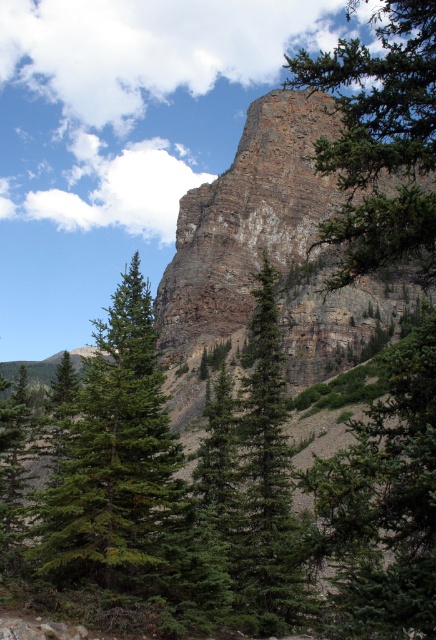
Can you confirm if green needle-like tree at center is positioned above rusty brown rock at upper center?

Incorrect, green needle-like tree at center is not positioned above rusty brown rock at upper center.

The height and width of the screenshot is (640, 436). What do you see at coordinates (115, 456) in the screenshot?
I see `green needle-like tree at center` at bounding box center [115, 456].

This screenshot has height=640, width=436. What are the coordinates of `green needle-like tree at center` in the screenshot? It's located at pyautogui.click(x=115, y=456).

Which is behind, point (160, 504) or point (245, 536)?

Point (245, 536)

The height and width of the screenshot is (640, 436). What do you see at coordinates (115, 456) in the screenshot? I see `green needle-like tree at center` at bounding box center [115, 456].

Does point (91, 516) come closer to viewer compared to point (255, 419)?

Yes, point (91, 516) is closer to viewer.

Locate an element on the screen. The width and height of the screenshot is (436, 640). green needle-like tree at center is located at coordinates (115, 456).

Who is more distant from viewer, [133,572] or [401,45]?

The point [401,45] is behind.

Who is higher up, green needle-like tree at center or green textured pine tree at upper right?

green textured pine tree at upper right is higher up.

Is point (115, 307) less distant than point (429, 81)?

No, (115, 307) is further to viewer.

Locate an element on the screen. This screenshot has width=436, height=640. green needle-like tree at center is located at coordinates (115, 456).